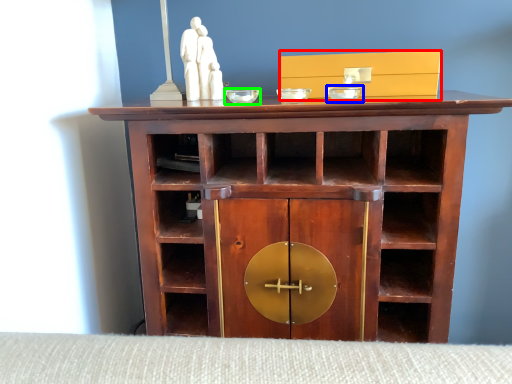
Question: Which is farther away from cabinetry (highlighted by a red box)? glass bowl (highlighted by a blue box) or glass bowl (highlighted by a green box)?

Choices:
 (A) glass bowl
 (B) glass bowl

Answer: (B)